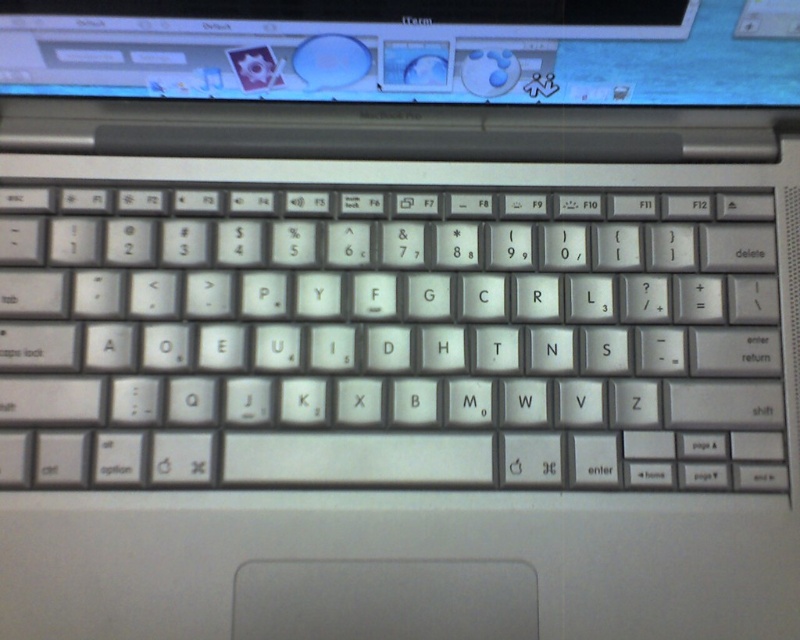
You are a user trying to place a protective cover over the satin silver keyboard at center and the shiny plastic screen at upper center. The cover you have is only large enough to fit one of them. Which object should you choose based on their sizes?

The satin silver keyboard at center is bigger than the shiny plastic screen at upper center, so the cover should be placed on the satin silver keyboard at center since it requires a larger cover.

You are setting up a laptop on a desk and want to place a mouse to the right of the satin silver keyboard at center. Considering the shiny plastic screen at upper center is wider than the keyboard, where should you position the mouse relative to the screen?

The shiny plastic screen at upper center is wider than the satin silver keyboard at center, so you should position the mouse to the right of the keyboard but within the screen width to ensure it doesn

You are taking a photo of the MacBook Pro keyboard and want to focus on both the point at point [540,268] and the point at point [608,81]. Which point is closer to the camera?

Point [540,268] is further to the camera than point [608,81], so the point at point [608,81] is closer to the camera.